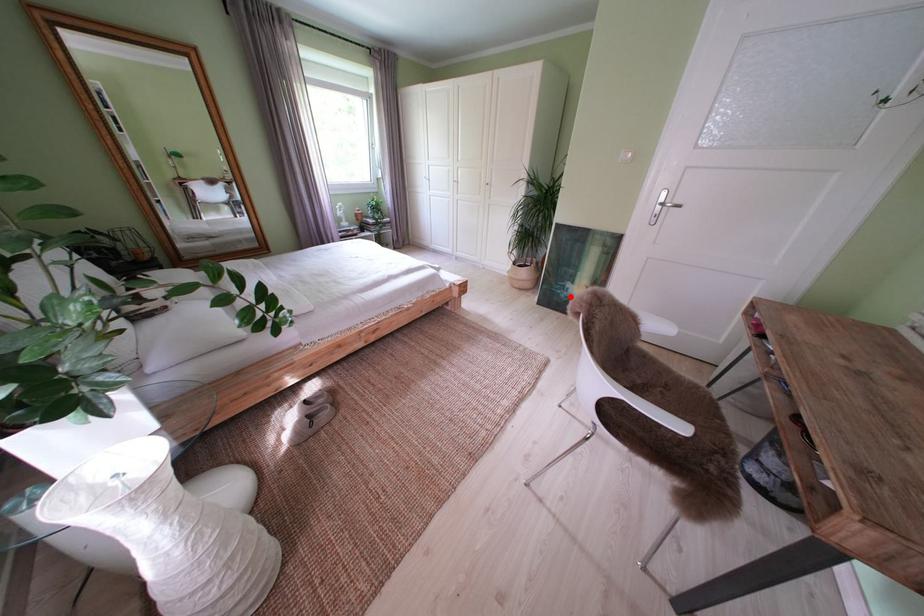
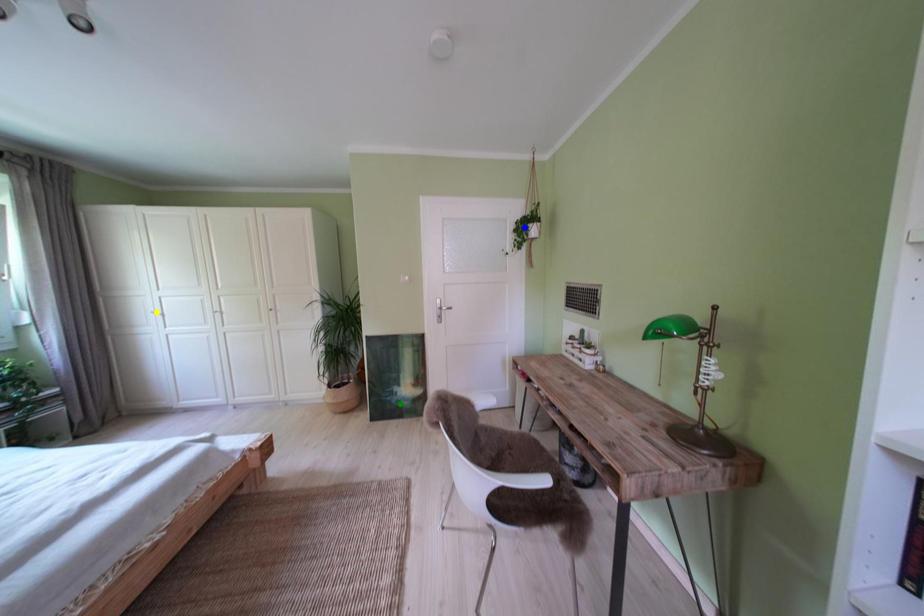
Question: I am providing you with two images of the same scene from different viewpoints. A red point is marked on the first image. You are given multiple points on the second image. In image 2, which mark is for the same physical point as the one in image 1?

Choices:
 (A) green point
 (B) blue point
 (C) yellow point

Answer: (A)